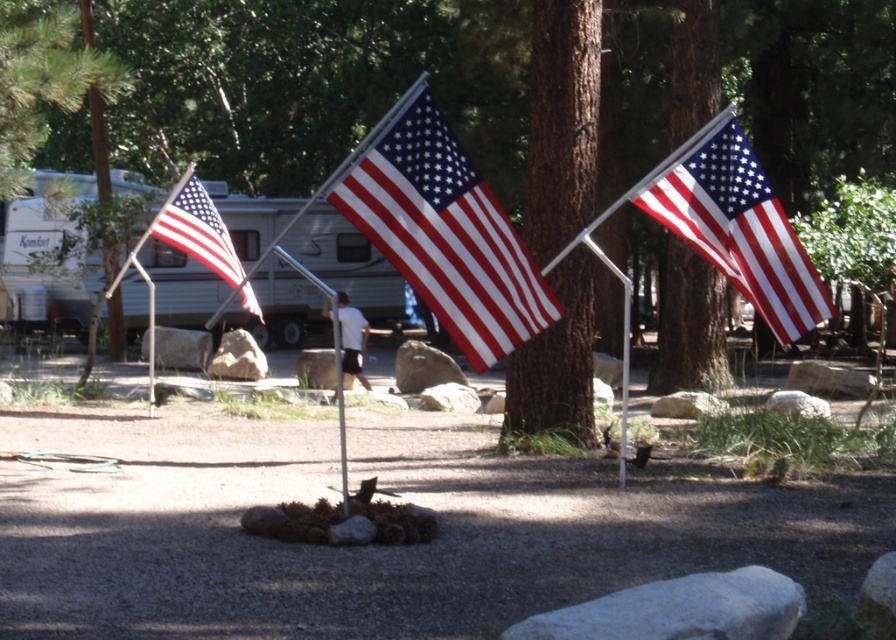
You are standing at the base of the flags in the camping scene. You see two points marked on the ground, point (311, 145) and point (343, 483). Which point is closer to you?

Point (343, 483) is closer to you because it is less far from the camera than point (311, 145).